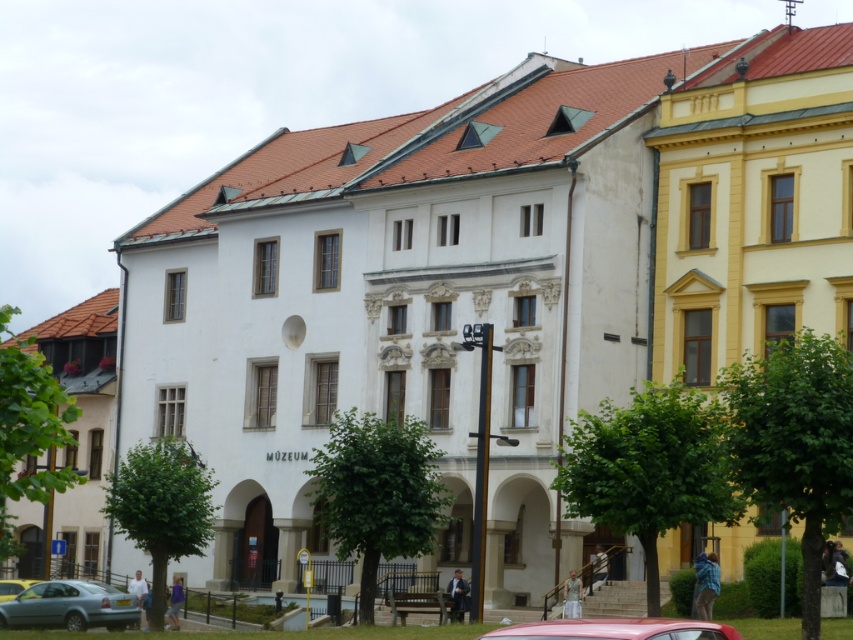
Which is in front, point (71, 609) or point (666, 621)?

Point (666, 621) is in front.

Find the location of a particular element. light blue metallic car at lower left is located at coordinates (70, 605).

Is metallic pink car at lower center wider than metallic silver car at lower left?

In fact, metallic pink car at lower center might be narrower than metallic silver car at lower left.

Based on the photo, who is more distant from viewer, (695, 634) or (25, 586)?

Positioned behind is point (25, 586).

Is point (518, 634) positioned behind point (20, 586)?

No, (518, 634) is closer to viewer.

Locate an element on the screen. metallic pink car at lower center is located at coordinates (614, 628).

Image resolution: width=853 pixels, height=640 pixels. Describe the element at coordinates (70, 605) in the screenshot. I see `light blue metallic car at lower left` at that location.

Based on the photo, can you confirm if light blue metallic car at lower left is shorter than metallic silver car at lower left?

Correct, light blue metallic car at lower left is not as tall as metallic silver car at lower left.

The height and width of the screenshot is (640, 853). Describe the element at coordinates (70, 605) in the screenshot. I see `light blue metallic car at lower left` at that location.

Where is `light blue metallic car at lower left`? The height and width of the screenshot is (640, 853). light blue metallic car at lower left is located at coordinates (70, 605).